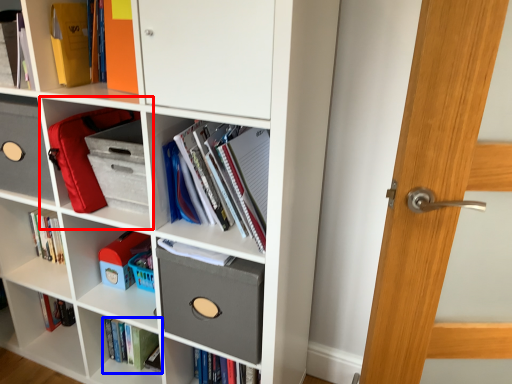
Question: Among these objects, which one is nearest to the camera, shelf (highlighted by a red box) or book (highlighted by a blue box)?

Choices:
 (A) shelf
 (B) book

Answer: (A)